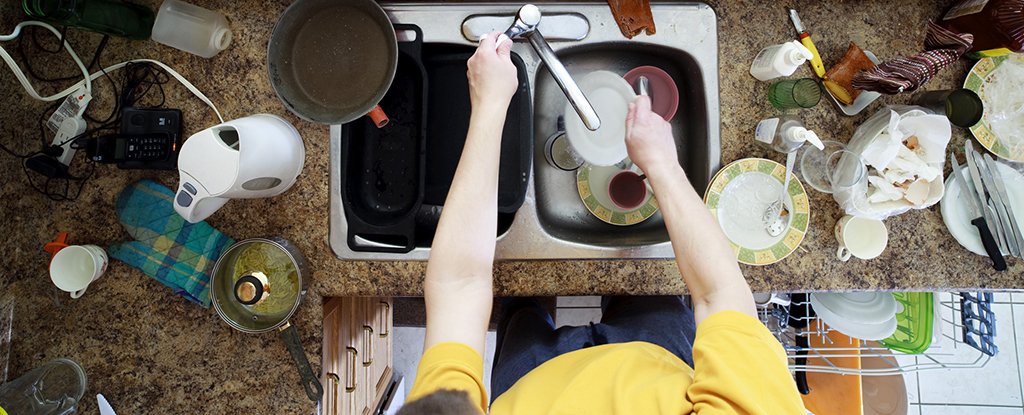
At what (x,y) coordinates should I click in order to perform the action: click on cabinet drawer handles. Please return your answer as a coordinate pair (x, y). This screenshot has width=1024, height=415. Looking at the image, I should click on (335, 388), (354, 379), (369, 352), (387, 324).